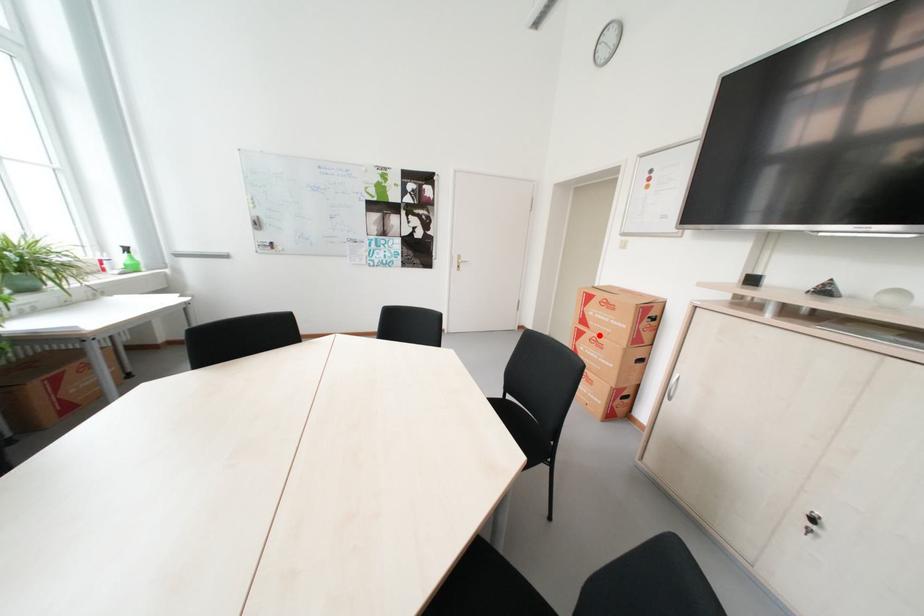
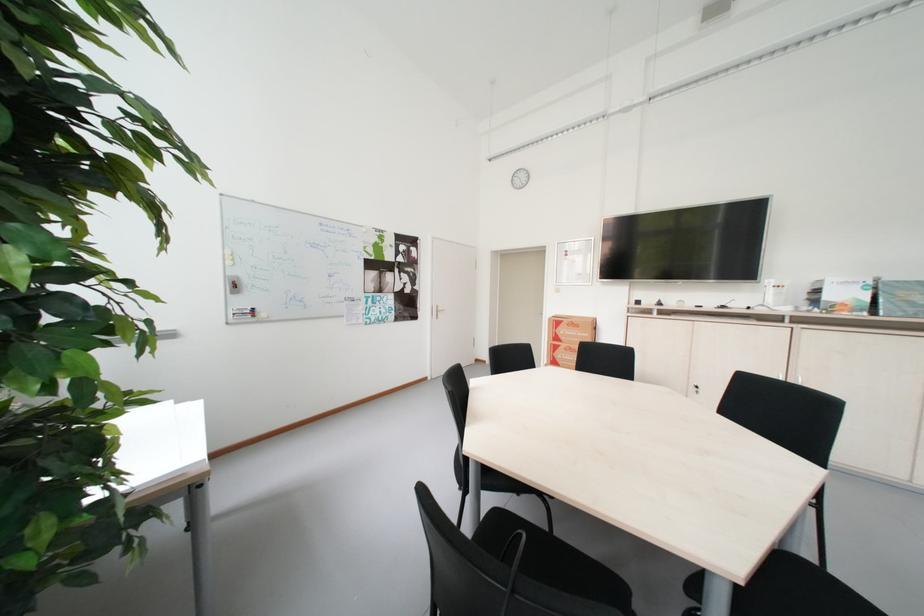
Find the pixel in the second image that matches the highlighted location in the first image.

(573, 347)